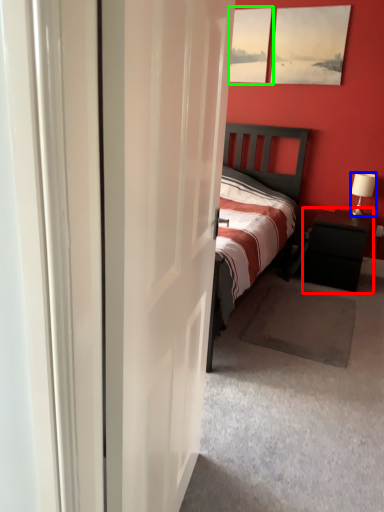
Question: Considering the real-world distances, which object is farthest from nightstand (highlighted by a red box)? lamp (highlighted by a blue box) or picture frame (highlighted by a green box)?

Choices:
 (A) lamp
 (B) picture frame

Answer: (B)